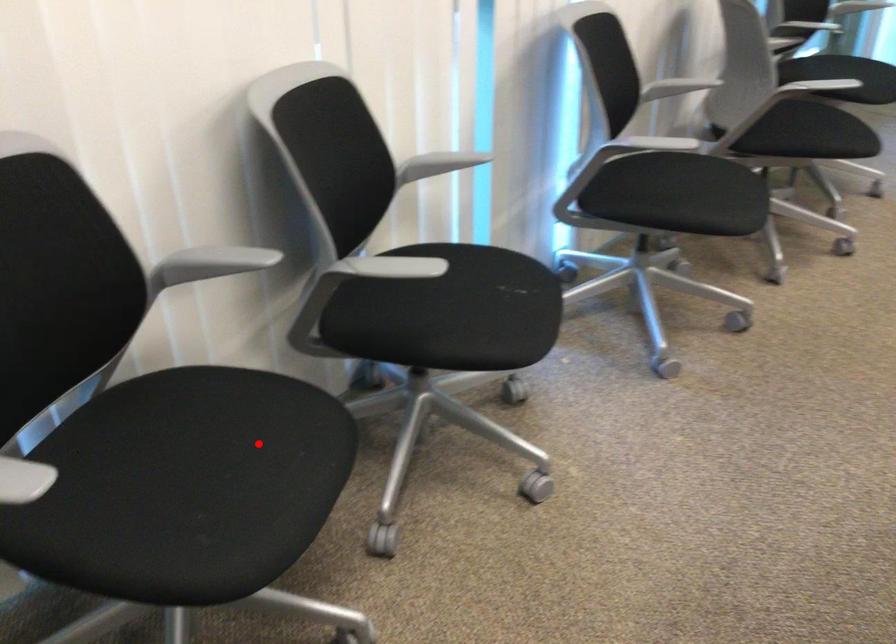
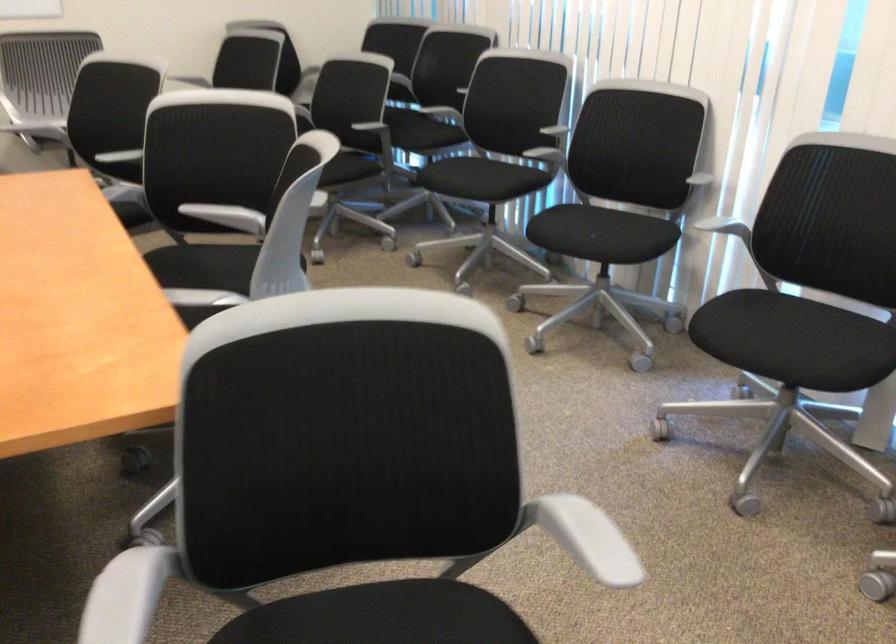
Find the pixel in the second image that matches the highlighted location in the first image.

(480, 178)